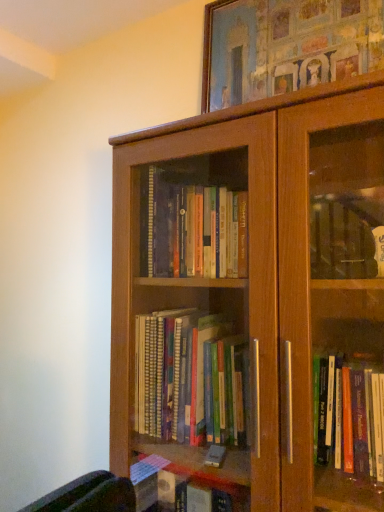
Question: Is wooden picture frame at upper center in front of or behind brown wood bookcase at center in the image?

Choices:
 (A) front
 (B) behind

Answer: (B)

Question: From a real-world perspective, is wooden picture frame at upper center above or below brown wood bookcase at center?

Choices:
 (A) above
 (B) below

Answer: (A)

Question: From the image's perspective, is wooden picture frame at upper center above or below brown wood bookcase at center?

Choices:
 (A) below
 (B) above

Answer: (B)

Question: In terms of width, does brown wood bookcase at center look wider or thinner when compared to wooden picture frame at upper center?

Choices:
 (A) thin
 (B) wide

Answer: (B)

Question: Would you say brown wood bookcase at center is to the left or to the right of wooden picture frame at upper center in the picture?

Choices:
 (A) right
 (B) left

Answer: (B)

Question: Considering the positions of point (312, 185) and point (225, 3), is point (312, 185) closer or farther from the camera than point (225, 3)?

Choices:
 (A) farther
 (B) closer

Answer: (B)

Question: Would you say brown wood bookcase at center is inside or outside wooden picture frame at upper center?

Choices:
 (A) inside
 (B) outside

Answer: (B)